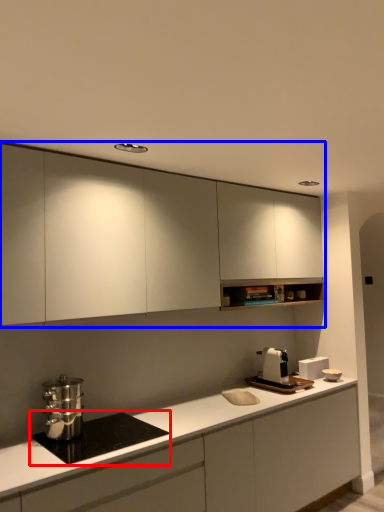
Question: Which object appears closest to the camera in this image, home appliance (highlighted by a red box) or cabinetry (highlighted by a blue box)?

Choices:
 (A) home appliance
 (B) cabinetry

Answer: (A)